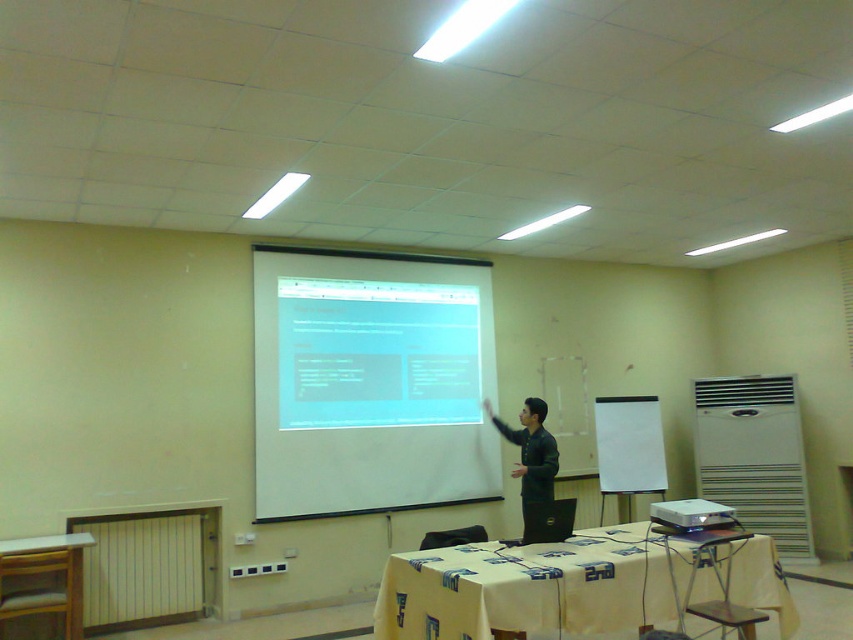
Does wooden table at lower left lie in front of green matte jacket at center?

Yes.

Who is more forward, (x=68, y=540) or (x=540, y=444)?

Point (x=68, y=540) is more forward.

What are the coordinates of `wooden table at lower left` in the screenshot? It's located at (44, 573).

Locate an element on the screen. This screenshot has height=640, width=853. wooden table at lower left is located at coordinates (44, 573).

Which is in front, point (0, 602) or point (675, 513)?

Point (675, 513)

Is wooden table at lower left to the right of white plastic projector at center from the viewer's perspective?

No, wooden table at lower left is not to the right of white plastic projector at center.

The image size is (853, 640). What do you see at coordinates (44, 573) in the screenshot?
I see `wooden table at lower left` at bounding box center [44, 573].

Where is `wooden table at lower left`? The height and width of the screenshot is (640, 853). wooden table at lower left is located at coordinates (44, 573).

Between white fabric table at lower center and green matte jacket at center, which one has less height?

white fabric table at lower center is shorter.

Does point (735, 584) come closer to viewer compared to point (524, 461)?

Yes.

Locate an element on the screen. Image resolution: width=853 pixels, height=640 pixels. white fabric table at lower center is located at coordinates 532,586.